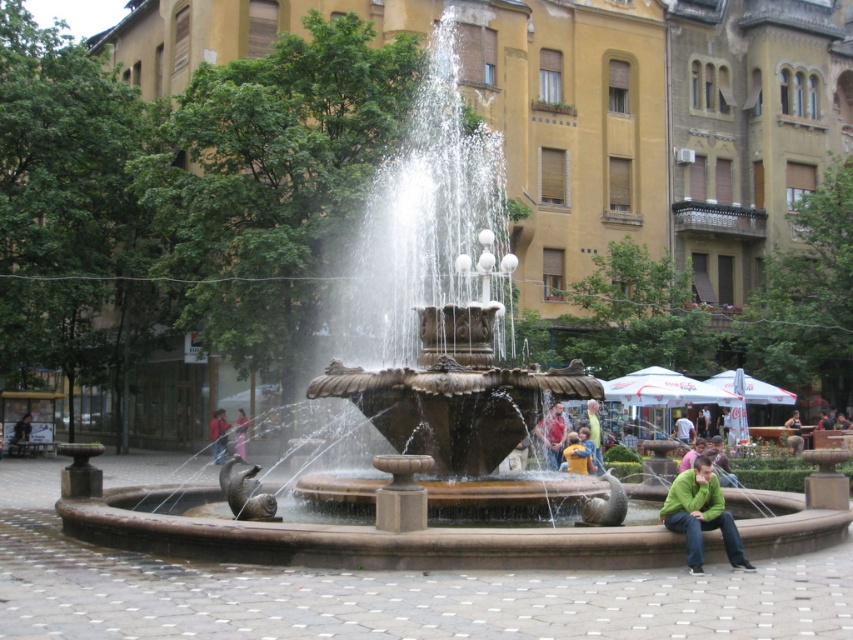
Which is more to the right, green matte jacket at lower right or yellow fabric person at lower right?

Positioned to the right is green matte jacket at lower right.

Is green matte jacket at lower right further to camera compared to yellow fabric person at lower right?

No.

I want to click on green matte jacket at lower right, so click(701, 515).

How far apart are matte brown jacket at center and red fabric jacket at lower left?

matte brown jacket at center is 25.24 meters from red fabric jacket at lower left.

Can you confirm if matte brown jacket at center is wider than red fabric jacket at lower left?

Yes.

Between point (553, 454) and point (213, 436), which one is positioned in front?

Point (553, 454) is in front.

Find the location of `matte brown jacket at center`. matte brown jacket at center is located at coordinates (552, 435).

Can you confirm if matte brown jacket at center is positioned to the left of yellow fabric person at lower right?

Yes, matte brown jacket at center is to the left of yellow fabric person at lower right.

This screenshot has height=640, width=853. What do you see at coordinates (552, 435) in the screenshot?
I see `matte brown jacket at center` at bounding box center [552, 435].

The height and width of the screenshot is (640, 853). What are the coordinates of `matte brown jacket at center` in the screenshot? It's located at (552, 435).